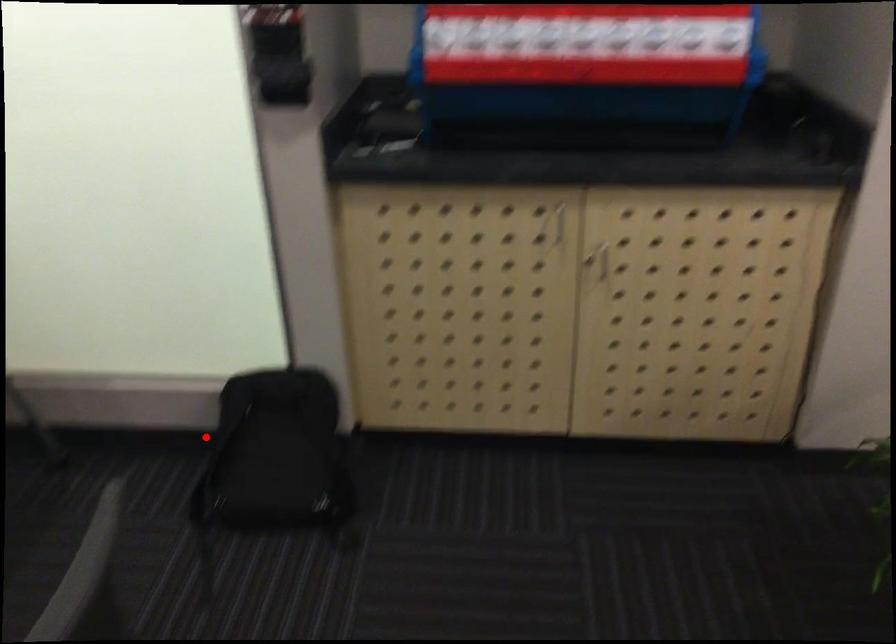
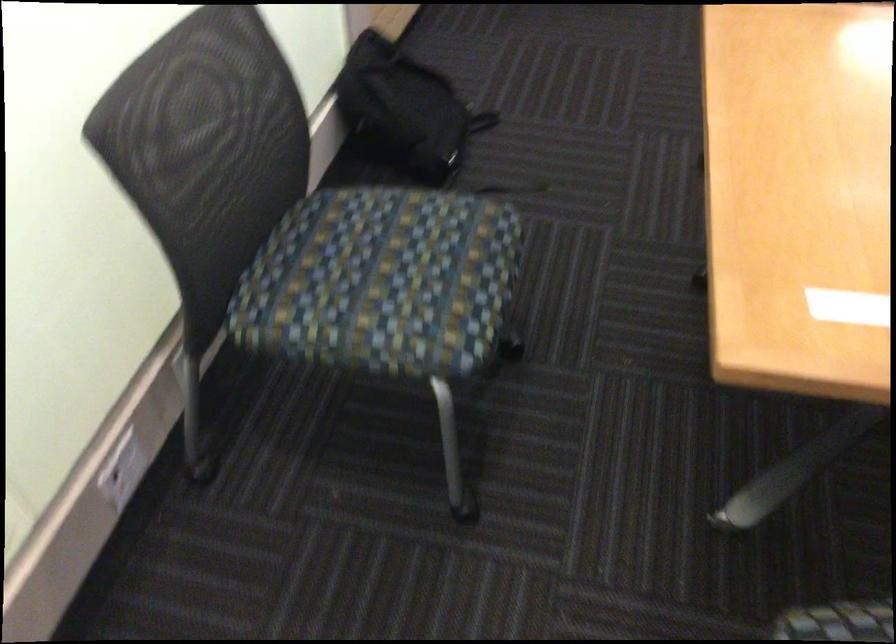
Where in the second image is the point corresponding to the highlighted location from the first image?

(405, 109)